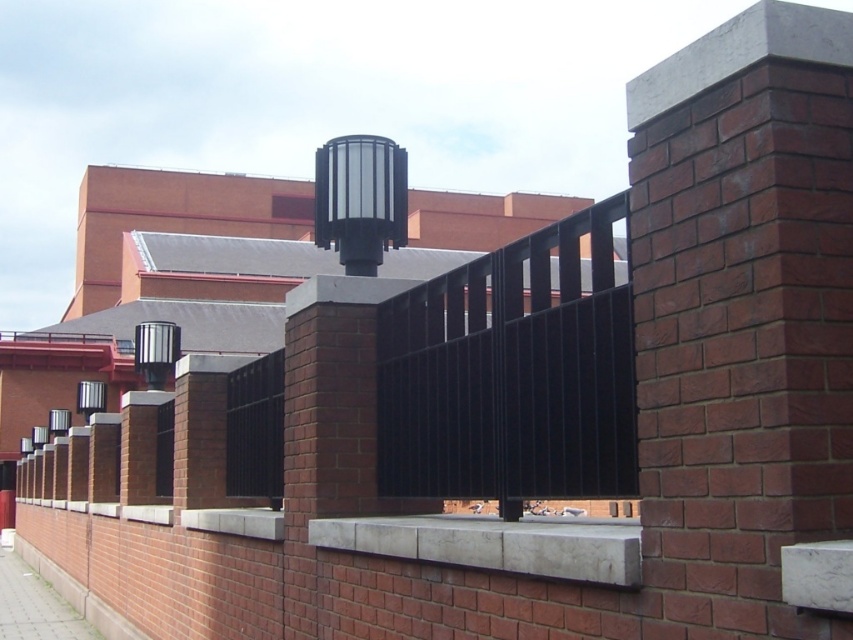
Does black metal fence at center have a lesser height compared to smooth concrete ledge at center?

No, black metal fence at center is not shorter than smooth concrete ledge at center.

Which is behind, point (624, 321) or point (480, 529)?

Point (480, 529)

Who is more distant from viewer, (572, 413) or (598, 544)?

The point (572, 413) is behind.

You are a GUI agent. You are given a task and a screenshot of the screen. Output one action in this format:
    pyautogui.click(x=<x>, y=<y>)
    Task: Click on the black metal fence at center
    The height and width of the screenshot is (640, 853).
    Given the screenshot: What is the action you would take?
    pyautogui.click(x=512, y=374)